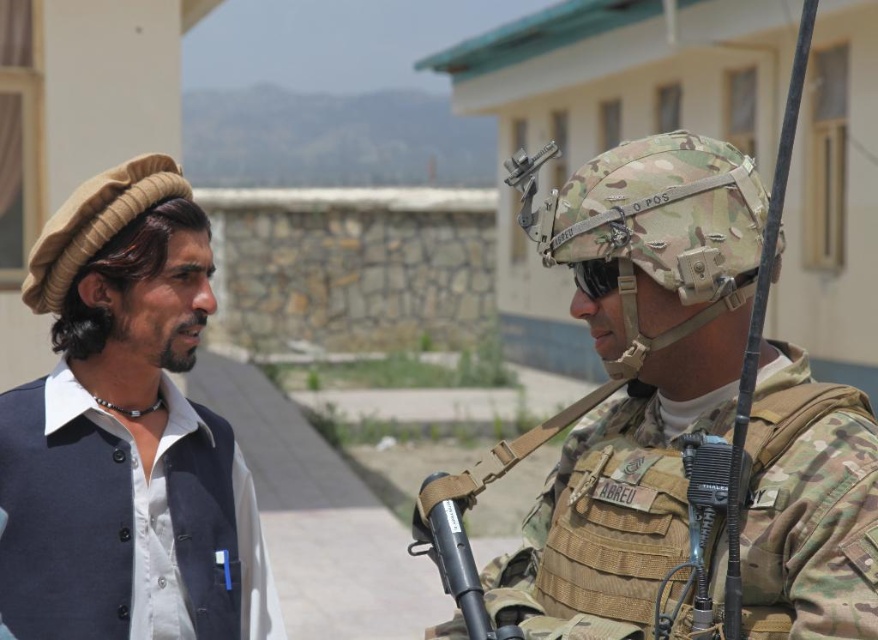
You are a photographer trying to capture both the camouflage fabric helmet at center and the dark blue fabric shirt at left in a single frame. Based on their positions, which object should you focus on first to ensure both are in the shot?

You should focus on the dark blue fabric shirt at left first because the camouflage fabric helmet at center is positioned to the right of it, so by centering the shirt in your frame, you can adjust to include both objects.

You are a tailor who needs to determine which item requires more fabric for a new order. Given the camouflage fabric helmet at center and the dark blue fabric shirt at left in the image, which one would need more fabric?

The camouflage fabric helmet at center requires more fabric because it is bigger than the dark blue fabric shirt at left.

You are a tailor trying to fit a customer for a new uniform. The customer has a camouflage fabric helmet at center and a dark blue fabric shirt at left. Which item requires a wider measurement for its width?

The camouflage fabric helmet at center requires a wider measurement because its width is larger than the dark blue fabric shirt at left.